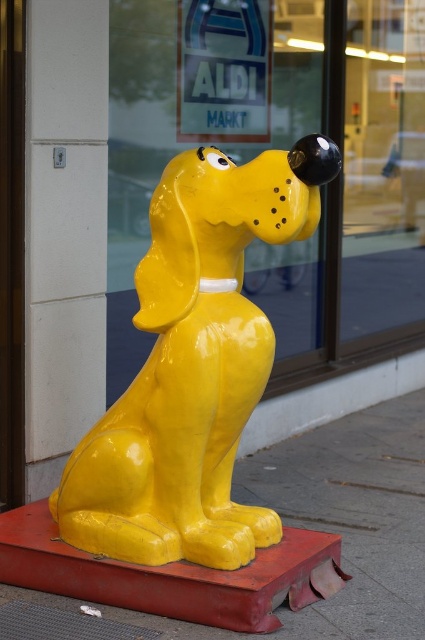
You are standing in front of the ALDI MARKT store and want to see both the glossy glass shop window at upper center and the glossy yellow dog at center. Which object has a smaller width?

The glossy glass shop window at upper center has a lesser width compared to the glossy yellow dog at center, so the glossy glass shop window at upper center is smaller in width.

You are a delivery person who needs to place a box on the floor in front of the glossy glass shop window at upper center and the matte yellow dog at center. Which object should you avoid placing the box in front of to prevent blocking the window reflection?

You should avoid placing the box in front of the glossy glass shop window at upper center because it is taller than the matte yellow dog at center, so blocking it would obstruct the reflection more significantly.